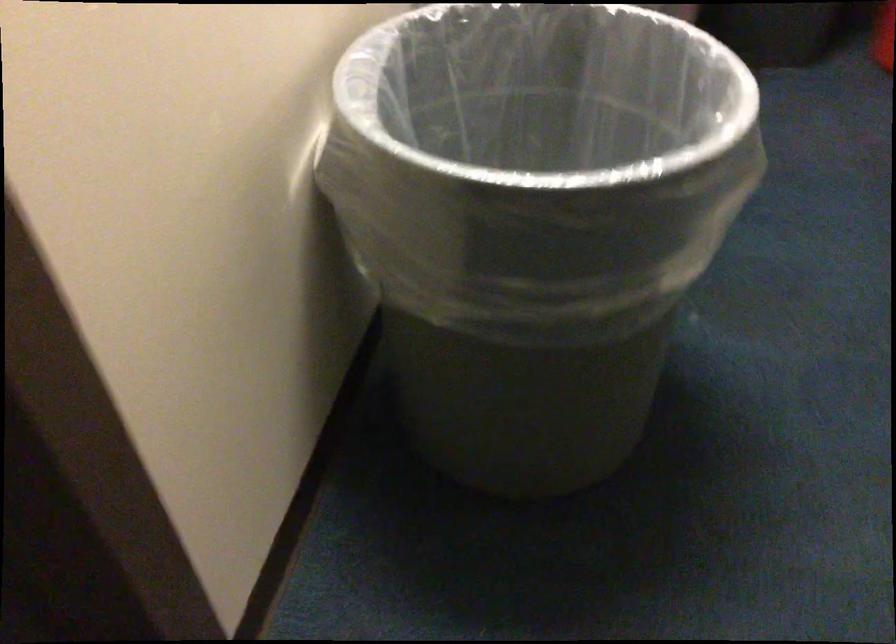
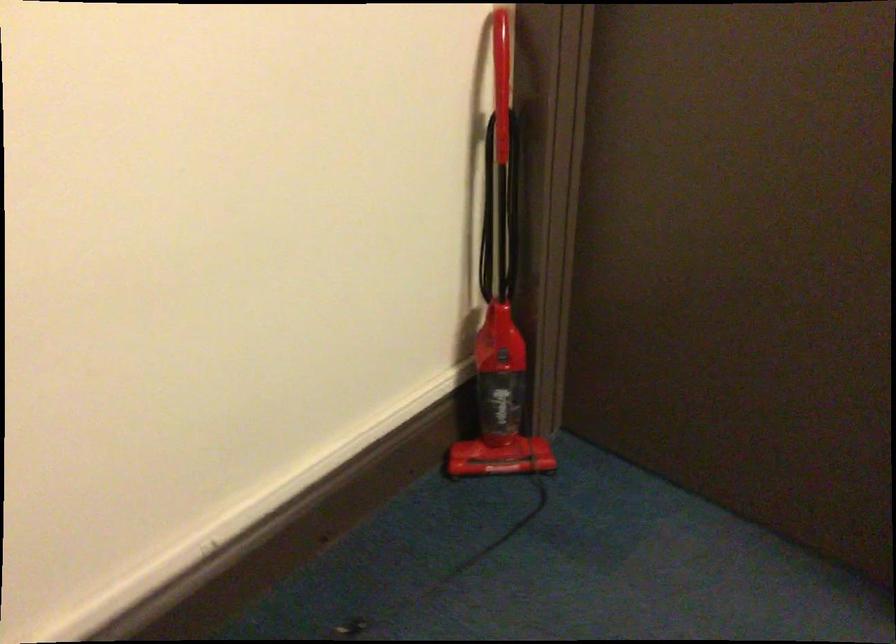
The images are taken continuously from a first-person perspective. In which direction is your viewpoint rotating?

The rotation direction of the camera is left-down.